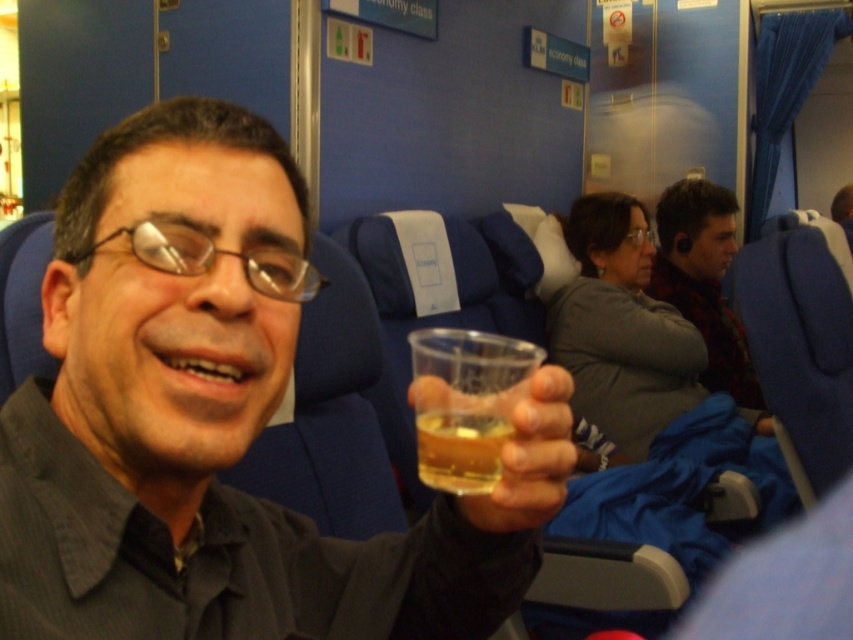
You are a flight attendant on an airplane. You need to retrieve the clear plastic cup at center from the economy class cabin. Where should you look to find it?

The clear plastic cup at center is located at the 2D coordinate point of (x=219, y=420) in the economy class cabin.

You are a flight attendant checking the items in the economy class section. You notice the clear plastic cup at center and the flannel shirt at center. Which item has a greater width?

The clear plastic cup at center has a greater width than the flannel shirt at center.

Where is the flannel shirt at center located in the image?

The flannel shirt at center is located at point (703,280) in the image.